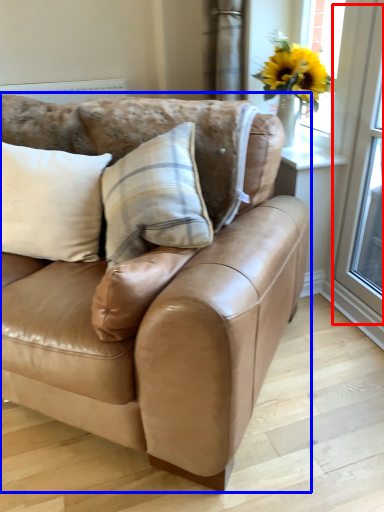
Question: Which object is further to the camera taking this photo, screen door (highlighted by a red box) or studio couch (highlighted by a blue box)?

Choices:
 (A) screen door
 (B) studio couch

Answer: (A)